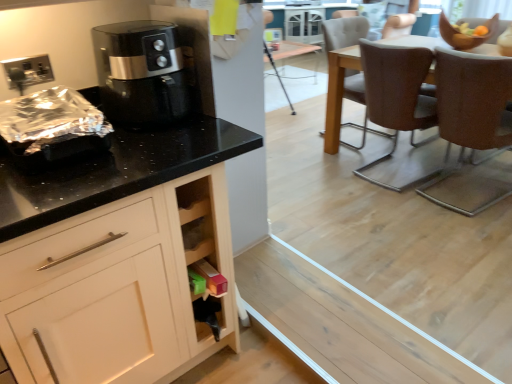
What do you see at coordinates (474, 100) in the screenshot? I see `brown leather chair at right, which is the 1th chair from front to back` at bounding box center [474, 100].

Measure the distance between point (408, 74) and camera.

Point (408, 74) is 2.35 meters away from camera.

Image resolution: width=512 pixels, height=384 pixels. Describe the element at coordinates (204, 256) in the screenshot. I see `wooden cabinet at lower center` at that location.

Describe the element at coordinates (343, 32) in the screenshot. I see `brown textured chair at right, acting as the 1th chair starting from the back` at that location.

Locate an element on the screen. The width and height of the screenshot is (512, 384). brown leather chair at right, which is the 1th chair from front to back is located at coordinates (474, 100).

Considering the relative positions of black glossy air fryer at upper left and wooden cabinet at lower center in the image provided, is black glossy air fryer at upper left to the left of wooden cabinet at lower center from the viewer's perspective?

Correct, you'll find black glossy air fryer at upper left to the left of wooden cabinet at lower center.

Between black glossy air fryer at upper left and wooden cabinet at lower center, which one has less height?

Standing shorter between the two is black glossy air fryer at upper left.

Considering the sizes of objects black glossy air fryer at upper left and wooden cabinet at lower center in the image provided, who is bigger, black glossy air fryer at upper left or wooden cabinet at lower center?

black glossy air fryer at upper left is bigger.

Is brown textured chair at right, placed as the third chair when sorted from front to back, in front of or behind wooden cabinet at lower center in the image?

brown textured chair at right, placed as the third chair when sorted from front to back, is behind wooden cabinet at lower center.

Is brown textured chair at right, acting as the 1th chair starting from the back, turned away from wooden cabinet at lower center?

That's not correct — brown textured chair at right, acting as the 1th chair starting from the back, is not looking away from wooden cabinet at lower center.

Considering the sizes of objects brown textured chair at right, placed as the third chair when sorted from front to back, and wooden cabinet at lower center in the image provided, who is taller, brown textured chair at right, placed as the third chair when sorted from front to back, or wooden cabinet at lower center?

brown textured chair at right, placed as the third chair when sorted from front to back.

Is brown textured chair at right, placed as the third chair when sorted from front to back, inside the boundaries of wooden cabinet at lower center, or outside?

brown textured chair at right, placed as the third chair when sorted from front to back, is outside wooden cabinet at lower center.

From the image's perspective, which is below, wooden cabinet at lower center or brown textured chair at right, acting as the 1th chair starting from the back?

wooden cabinet at lower center, from the image's perspective.

How many degrees apart are the facing directions of wooden cabinet at lower center and brown textured chair at right, acting as the 1th chair starting from the back?

96 degrees separate the facing orientations of wooden cabinet at lower center and brown textured chair at right, acting as the 1th chair starting from the back.

Locate an element on the screen. This screenshot has width=512, height=384. cabinetry in front of the brown textured chair at right, acting as the 1th chair starting from the back is located at coordinates (204, 256).

Does point (218, 250) lie behind point (356, 38)?

No.

Is point (188, 237) behind point (412, 81)?

No, it is in front of (412, 81).

Does wooden cabinet at lower center have a smaller size compared to brown leather chair at center, marked as the second chair in a back-to-front arrangement?

Yes.

In the scene shown: Does wooden cabinet at lower center have a lesser width compared to brown leather chair at center, which is counted as the 2th chair, starting from the front?

Correct, the width of wooden cabinet at lower center is less than that of brown leather chair at center, which is counted as the 2th chair, starting from the front.

Looking at this image, considering the relative sizes of wooden cabinet at lower center and brown leather chair at center, marked as the second chair in a back-to-front arrangement, in the image provided, is wooden cabinet at lower center taller than brown leather chair at center, marked as the second chair in a back-to-front arrangement,?

No, wooden cabinet at lower center is not taller than brown leather chair at center, marked as the second chair in a back-to-front arrangement.

Looking at this image, between wooden cabinet at lower center and brown leather chair at right, positioned as the 3th chair in back-to-front order, which one has smaller width?

With smaller width is wooden cabinet at lower center.

Based on the photo, which object is more forward, wooden cabinet at lower center or brown leather chair at right, which is the 1th chair from front to back?

wooden cabinet at lower center is in front.

Can you confirm if wooden cabinet at lower center is smaller than brown leather chair at right, positioned as the 3th chair in back-to-front order?

Yes, wooden cabinet at lower center is smaller than brown leather chair at right, positioned as the 3th chair in back-to-front order.

From the image's perspective, does wooden cabinet at lower center appear lower than brown leather chair at right, which is the 1th chair from front to back?

Yes, from the image's perspective, wooden cabinet at lower center is below brown leather chair at right, which is the 1th chair from front to back.

Does point (366, 105) appear closer or farther from the camera than point (208, 290)?

Point (366, 105) appears to be farther away from the viewer than point (208, 290).

From the picture: Can you confirm if brown leather chair at center, marked as the second chair in a back-to-front arrangement, is thinner than wooden cabinet at lower center?

No, brown leather chair at center, marked as the second chair in a back-to-front arrangement, is not thinner than wooden cabinet at lower center.

From the picture: Can you confirm if brown leather chair at center, which is counted as the 2th chair, starting from the front, is smaller than wooden cabinet at lower center?

Incorrect, brown leather chair at center, which is counted as the 2th chair, starting from the front, is not smaller in size than wooden cabinet at lower center.

From a real-world perspective, who is located higher, brown leather chair at center, marked as the second chair in a back-to-front arrangement, or wooden cabinet at lower center?

In real-world perspective, brown leather chair at center, marked as the second chair in a back-to-front arrangement, is above.

From the image's perspective, is brown leather chair at right, which is the 1th chair from front to back, over brown textured chair at right, acting as the 1th chair starting from the back?

No.

Which point is more forward, (492, 87) or (356, 17)?

The point (492, 87) is more forward.

Can you tell me how much brown leather chair at right, positioned as the 3th chair in back-to-front order, and brown textured chair at right, acting as the 1th chair starting from the back, differ in facing direction?

brown leather chair at right, positioned as the 3th chair in back-to-front order, and brown textured chair at right, acting as the 1th chair starting from the back, are facing 94.8 degrees away from each other.

Is brown leather chair at right, which is the 1th chair from front to back, at the left side of brown textured chair at right, placed as the third chair when sorted from front to back?

No, brown leather chair at right, which is the 1th chair from front to back, is not to the left of brown textured chair at right, placed as the third chair when sorted from front to back.

The width and height of the screenshot is (512, 384). Find the location of `coffee machine above the wooden cabinet at lower center (from a real-world perspective)`. coffee machine above the wooden cabinet at lower center (from a real-world perspective) is located at coordinates (141, 74).

You are a GUI agent. You are given a task and a screenshot of the screen. Output one action in this format:
    pyautogui.click(x=<x>, y=<y>)
    Task: Click on the cabinetry to the left of brown textured chair at right, acting as the 1th chair starting from the back
    This screenshot has height=384, width=512.
    Given the screenshot: What is the action you would take?
    pyautogui.click(x=204, y=256)

When comparing their distances from brown leather chair at right, positioned as the 3th chair in back-to-front order, does brown leather chair at center, which is counted as the 2th chair, starting from the front, or brown textured chair at right, placed as the third chair when sorted from front to back, seem closer?

brown leather chair at center, which is counted as the 2th chair, starting from the front, is closer to brown leather chair at right, positioned as the 3th chair in back-to-front order.

Looking at the image, which one is located further to brown leather chair at center, marked as the second chair in a back-to-front arrangement, black glossy air fryer at upper left or brown textured chair at right, acting as the 1th chair starting from the back?

Among the two, black glossy air fryer at upper left is located further to brown leather chair at center, marked as the second chair in a back-to-front arrangement.

From the image, which object appears to be nearer to black glossy air fryer at upper left, brown textured chair at right, acting as the 1th chair starting from the back, or wooden cabinet at lower center?

wooden cabinet at lower center is closer to black glossy air fryer at upper left.

From the image, which object appears to be nearer to brown leather chair at right, positioned as the 3th chair in back-to-front order, brown textured chair at right, placed as the third chair when sorted from front to back, or brown leather chair at center, which is counted as the 2th chair, starting from the front?

brown leather chair at center, which is counted as the 2th chair, starting from the front, lies closer to brown leather chair at right, positioned as the 3th chair in back-to-front order, than the other object.

Considering their positions, is brown textured chair at right, placed as the third chair when sorted from front to back, positioned closer to wooden cabinet at lower center than black glossy air fryer at upper left?

Based on the image, black glossy air fryer at upper left appears to be nearer to wooden cabinet at lower center.

Based on the photo, based on their spatial positions, is black glossy air fryer at upper left or brown leather chair at center, marked as the second chair in a back-to-front arrangement, closer to brown textured chair at right, acting as the 1th chair starting from the back?

brown leather chair at center, marked as the second chair in a back-to-front arrangement.

Estimate the real-world distances between objects in this image. Which object is closer to brown leather chair at right, which is the 1th chair from front to back, wooden cabinet at lower center or black glossy air fryer at upper left?

black glossy air fryer at upper left lies closer to brown leather chair at right, which is the 1th chair from front to back, than the other object.

Estimate the real-world distances between objects in this image. Which object is closer to brown textured chair at right, acting as the 1th chair starting from the back, brown leather chair at center, marked as the second chair in a back-to-front arrangement, or brown leather chair at right, which is the 1th chair from front to back?

The object closer to brown textured chair at right, acting as the 1th chair starting from the back, is brown leather chair at center, marked as the second chair in a back-to-front arrangement.

Locate an element on the screen. This screenshot has width=512, height=384. cabinetry between black glossy air fryer at upper left and brown textured chair at right, acting as the 1th chair starting from the back, along the z-axis is located at coordinates (204, 256).

The height and width of the screenshot is (384, 512). In order to click on chair located between brown leather chair at right, which is the 1th chair from front to back, and brown textured chair at right, acting as the 1th chair starting from the back, in the depth direction in this screenshot , I will do `click(397, 97)`.

Find the location of a particular element. cabinetry located between black glossy air fryer at upper left and brown leather chair at right, which is the 1th chair from front to back, in the left-right direction is located at coordinates (204, 256).

I want to click on cabinetry located between black glossy air fryer at upper left and brown leather chair at center, marked as the second chair in a back-to-front arrangement, in the left-right direction, so (x=204, y=256).